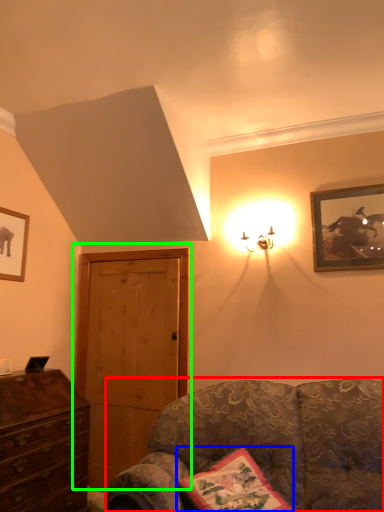
Question: Which object is positioned farthest from studio couch (highlighted by a red box)? Select from pillow (highlighted by a blue box) and door (highlighted by a green box).

Choices:
 (A) pillow
 (B) door

Answer: (B)